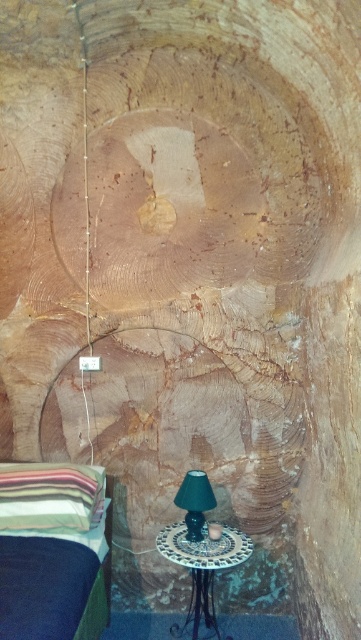
Question: Among these objects, which one is farthest from the camera?

Choices:
 (A) metallic wire at left
 (B) porcelain mosaic table at center

Answer: (A)

Question: Can you confirm if porcelain mosaic table at center is wider than metallic wire at left?

Choices:
 (A) yes
 (B) no

Answer: (A)

Question: Does striped fabric bed at lower left appear over striped fabric pillow at lower left?

Choices:
 (A) no
 (B) yes

Answer: (A)

Question: Considering the relative positions of metallic wire at left and green fabric lampshade at lower center in the image provided, where is metallic wire at left located with respect to green fabric lampshade at lower center?

Choices:
 (A) right
 (B) left

Answer: (B)

Question: Which of these objects is positioned farthest from the striped fabric pillow at lower left?

Choices:
 (A) porcelain mosaic table at center
 (B) green fabric lampshade at lower center

Answer: (A)

Question: Considering the real-world distances, which object is closest to the metallic wire at left?

Choices:
 (A) green fabric lampshade at lower center
 (B) striped fabric bed at lower left
 (C) striped fabric pillow at lower left

Answer: (C)